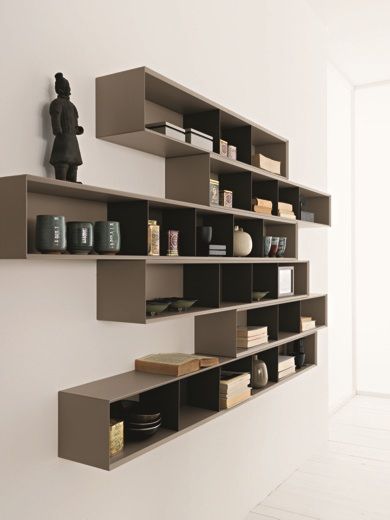
You are a GUI agent. You are given a task and a screenshot of the screen. Output one action in this format:
    pyautogui.click(x=<x>, y=<y>)
    Task: Click on the top and bottom shelves
    This screenshot has width=390, height=520.
    Given the screenshot: What is the action you would take?
    pyautogui.click(x=173, y=108), pyautogui.click(x=238, y=132), pyautogui.click(x=277, y=146), pyautogui.click(x=307, y=355), pyautogui.click(x=261, y=369), pyautogui.click(x=241, y=387), pyautogui.click(x=195, y=397), pyautogui.click(x=142, y=416)